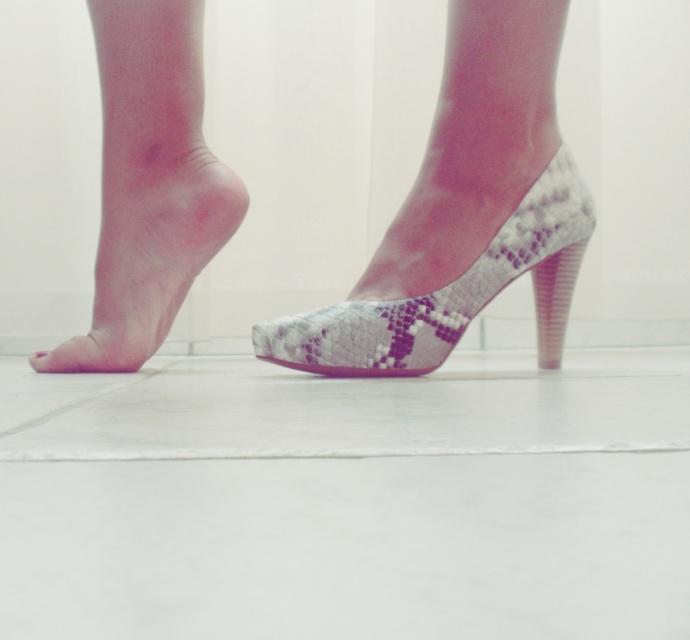
Does pink smooth skin at lower left lie behind snake skin sock at center?

That is True.

Find the location of `pink smooth skin at lower left`. pink smooth skin at lower left is located at coordinates (148, 182).

Can you confirm if snake skin high heel at lower right is bigger than pink smooth skin at lower left?

Yes, snake skin high heel at lower right is bigger than pink smooth skin at lower left.

At what (x,y) coordinates should I click in order to perform the action: click on snake skin high heel at lower right. Please return your answer as a coordinate pair (x, y). This screenshot has height=640, width=690. Looking at the image, I should click on (451, 198).

The height and width of the screenshot is (640, 690). Identify the location of snake skin high heel at lower right. (451, 198).

Measure the distance between snake skin high heel at lower right and snake skin sock at center.

snake skin high heel at lower right and snake skin sock at center are 2.87 inches apart.

Does snake skin high heel at lower right lie in front of snake skin sock at center?

No.

The image size is (690, 640). Identify the location of snake skin high heel at lower right. (451, 198).

Identify the location of snake skin high heel at lower right. (451, 198).